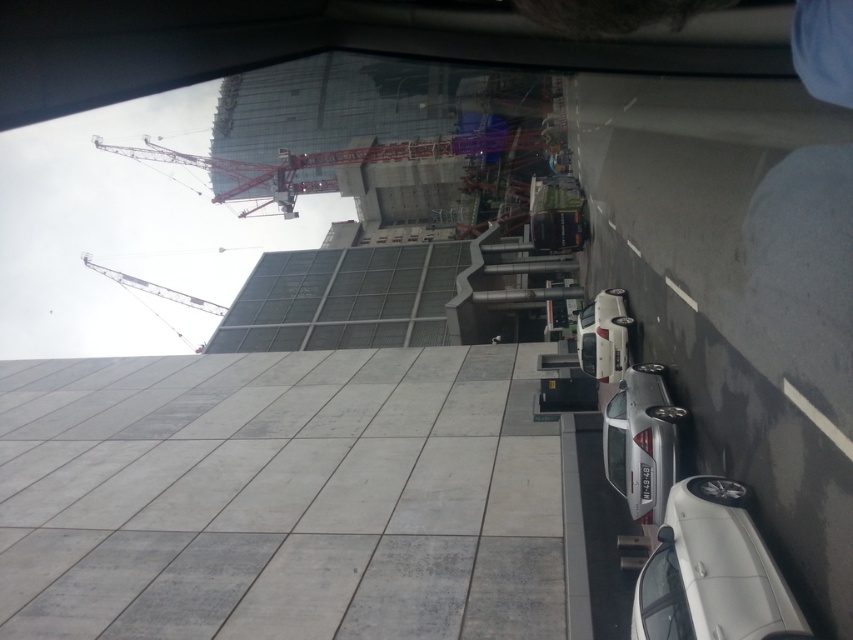
Question: Is red metal crane at upper center positioned before metallic gray crane at upper left?

Choices:
 (A) yes
 (B) no

Answer: (B)

Question: Is red metal crane at upper center below metallic gray crane at upper left?

Choices:
 (A) no
 (B) yes

Answer: (A)

Question: Is red metal crane at upper center closer to the viewer compared to metallic gray crane at upper left?

Choices:
 (A) yes
 (B) no

Answer: (B)

Question: Which of the following is the closest to the observer?

Choices:
 (A) (451, 136)
 (B) (114, 276)

Answer: (A)